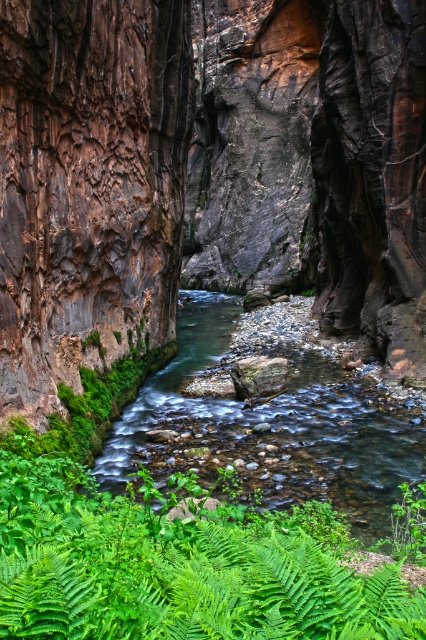
You are standing at the point marked by the coordinates point (89, 186) in the canyon. Looking around, you notice a brown rough cliff to your left. What direction should you face to see the brown rough cliff at left?

You should face to your left to see the brown rough cliff at left, as the point (89, 186) marks its location.

You are a hiker standing at the edge of the brown rough cliff at left. You want to cross to the other side of the canyon. The distance between you and the opposite wall is 10.30 meters. Can you safely jump across the canyon?

The distance between you and the opposite wall is 10.30 meters, which is too far to safely jump. You should find another way to cross.

You are a hiker trying to cross the canyon. You see the brown rough cliff at left and the green leafy ferns at center. Which path would allow you to walk closer to the stream without getting too close to the cliff?

The path near the green leafy ferns at center would allow you to walk closer to the stream without getting too close to the brown rough cliff at left since the cliff is wider than the ferns area.